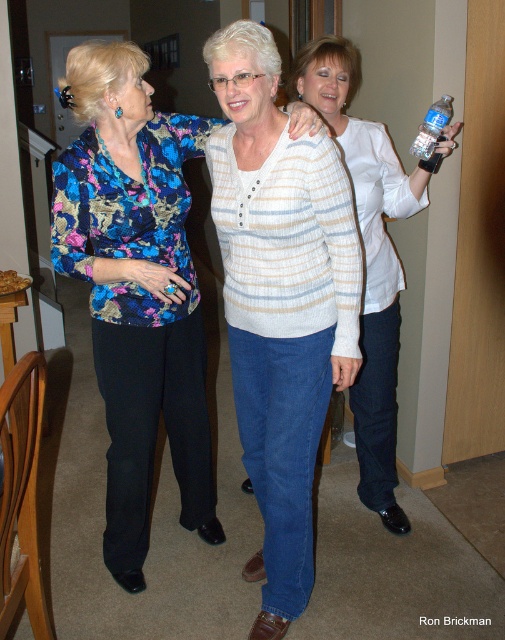
Can you confirm if white striped sweater at center is positioned to the right of white matte jacket at center?

Incorrect, white striped sweater at center is not on the right side of white matte jacket at center.

Which is in front, point (323, 300) or point (330, 42)?

Point (323, 300)

Where is `white striped sweater at center`? The width and height of the screenshot is (505, 640). white striped sweater at center is located at coordinates (279, 301).

Is floral-patterned blouse at center above white matte jacket at center?

Actually, floral-patterned blouse at center is below white matte jacket at center.

At what (x,y) coordinates should I click in order to perform the action: click on floral-patterned blouse at center. Please return your answer as a coordinate pair (x, y). The height and width of the screenshot is (640, 505). Looking at the image, I should click on (135, 289).

Who is more distant from viewer, (x=146, y=269) or (x=382, y=372)?

The point (x=382, y=372) is more distant.

Locate an element on the screen. floral-patterned blouse at center is located at coordinates (135, 289).

Which of these two, white striped sweater at center or clear plastic bottle at upper right, stands taller?

white striped sweater at center is taller.

Who is higher up, white striped sweater at center or clear plastic bottle at upper right?

clear plastic bottle at upper right

Where is `white striped sweater at center`? The width and height of the screenshot is (505, 640). white striped sweater at center is located at coordinates (279, 301).